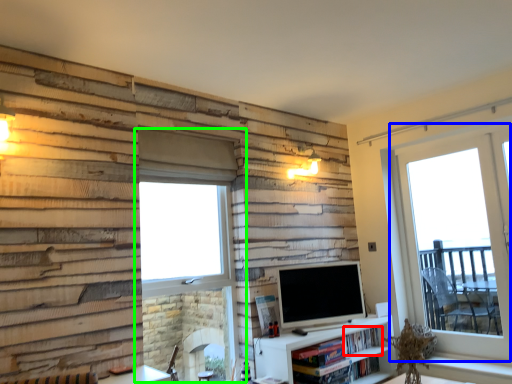
Question: Which object is positioned closest to book (highlighted by a red box)? Select from window (highlighted by a blue box) and window (highlighted by a green box).

Choices:
 (A) window
 (B) window

Answer: (A)